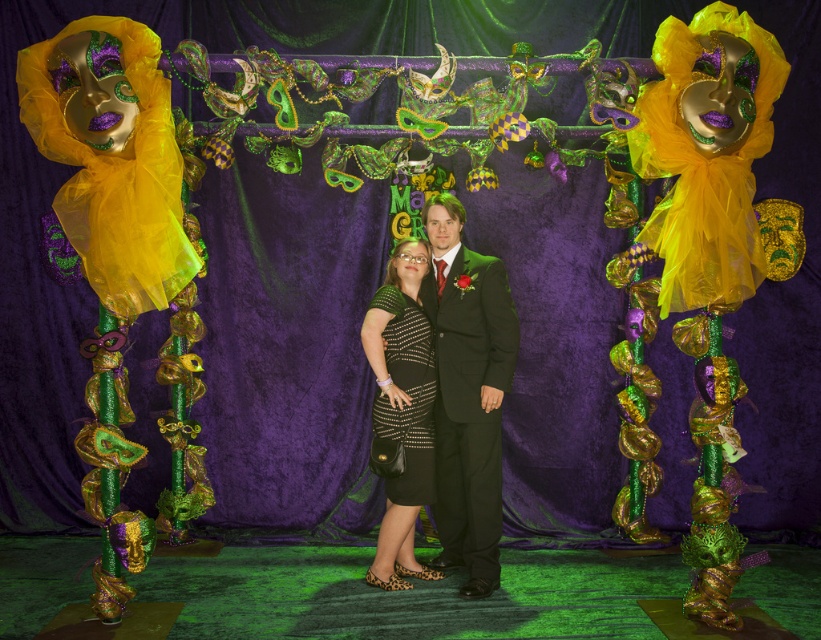
You are a photographer at a Mardi Gras event. You need to capture a photo of both the shiny black dress at center and the black sequined dress at center. The camera you are using has a lens that can focus on objects within a 6 inch range. Will both dresses fit within the camera lens range?

The distance between the shiny black dress at center and the black sequined dress at center is 5.95 inches, which is within the 6 inch range of the camera lens. Therefore, both dresses will fit within the camera lens range.

You are a photographer at a Mardi Gras event. You need to position a light to the left of the shiny black dress at center and to the right of the black sequined dress at center. Is this possible?

Yes, because the shiny black dress at center is to the right of the black sequined dress at center, so placing the light between them would satisfy both conditions.